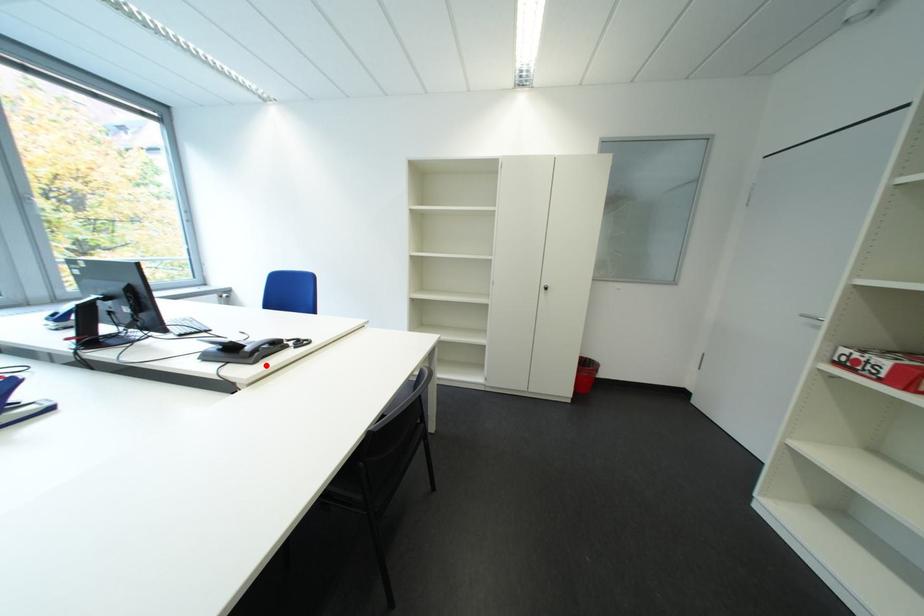
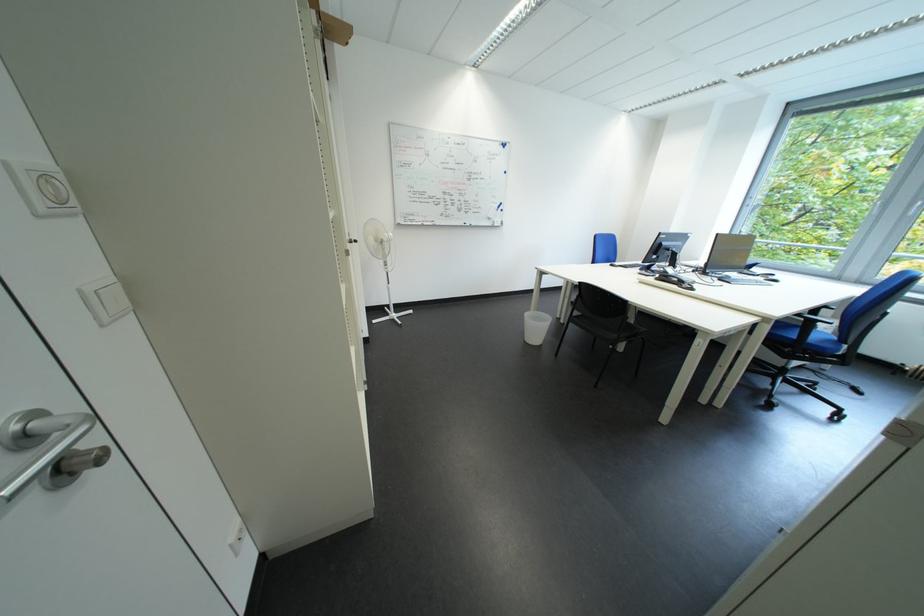
Find the pixel in the second image that matches the highlighted location in the first image.

(669, 282)